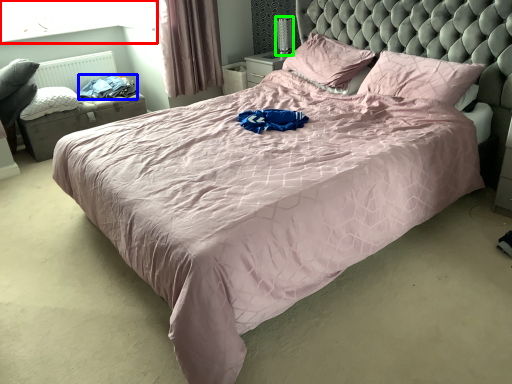
Question: Which is farther away from window screen (highlighted by a red box)? clothing (highlighted by a blue box) or table lamp (highlighted by a green box)?

Choices:
 (A) clothing
 (B) table lamp

Answer: (B)